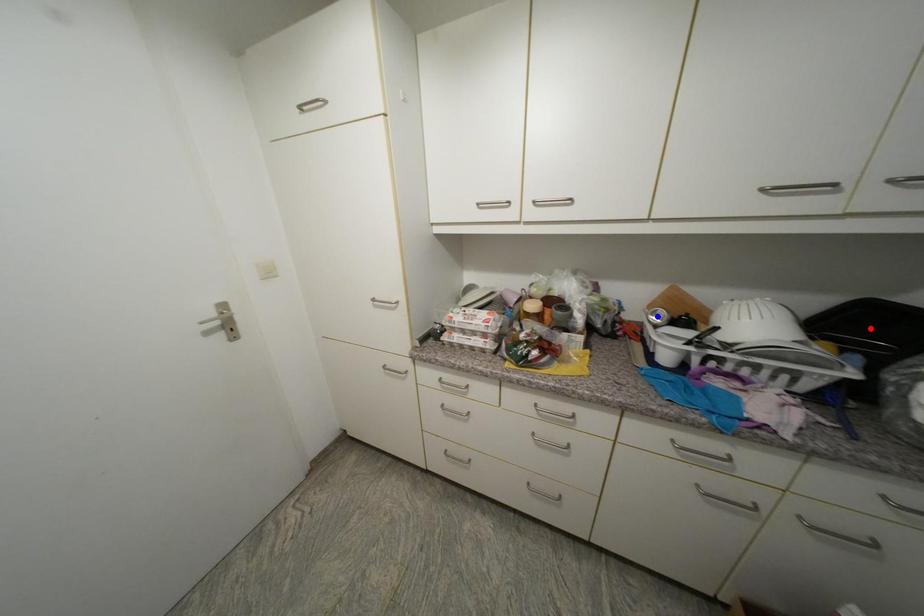
Question: Which of the two points in the image is closer to the camera?

Choices:
 (A) Blue point is closer.
 (B) Red point is closer.

Answer: (B)